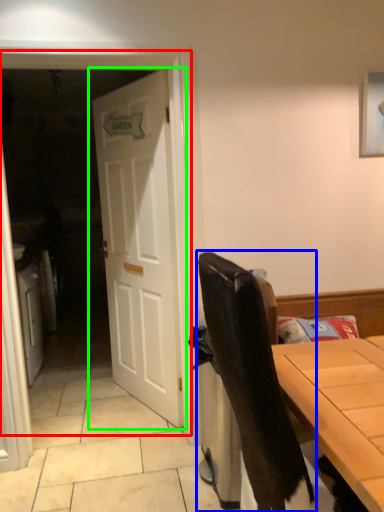
Question: Which is nearer to the screen door (highlighted by a red box)? chair (highlighted by a blue box) or door (highlighted by a green box).

Choices:
 (A) chair
 (B) door

Answer: (B)